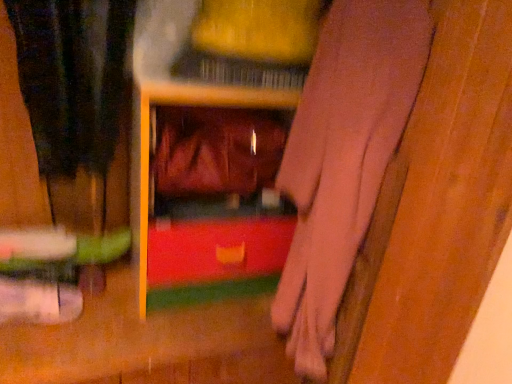
Locate an element on the screen. The image size is (512, 384). free space in front of matte plastic drawer at center is located at coordinates (174, 344).